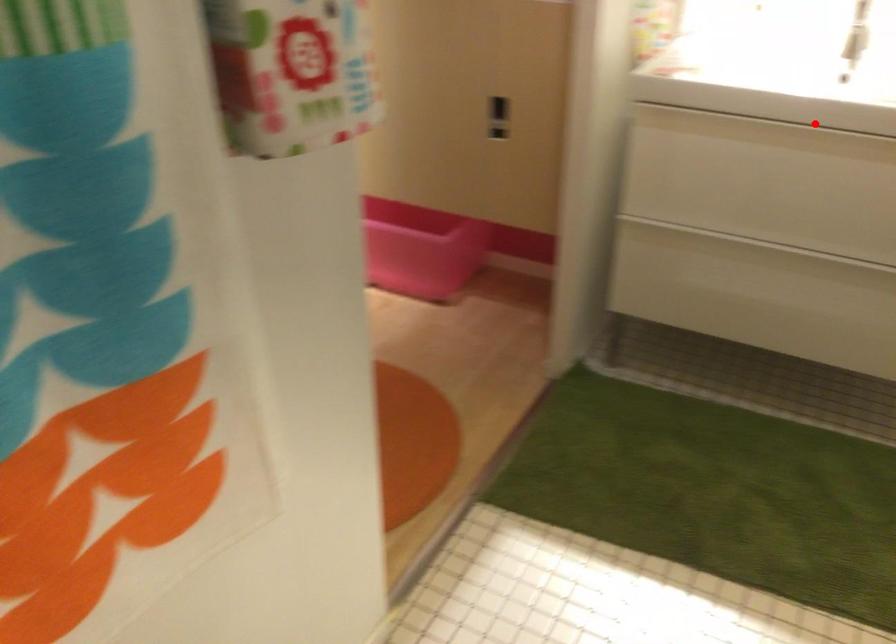
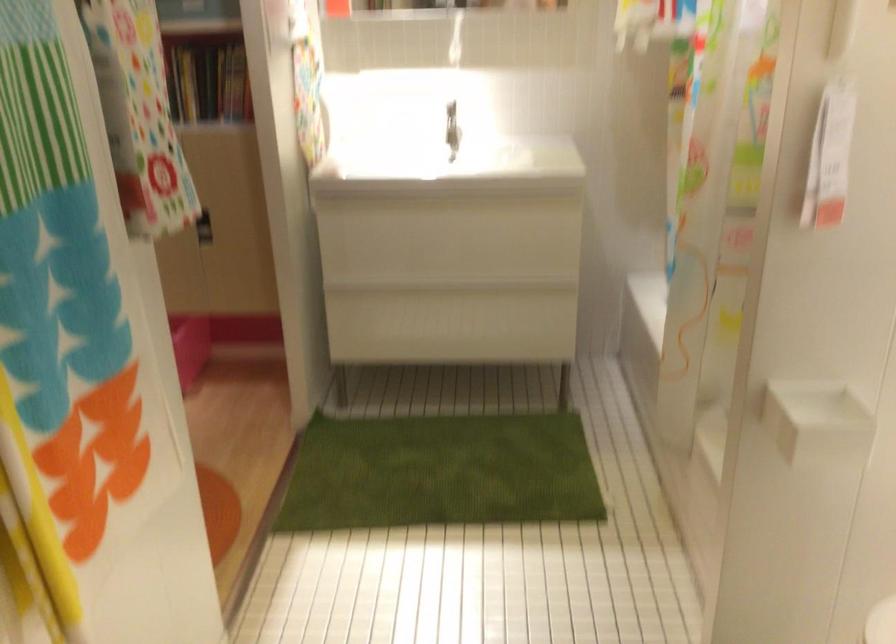
In the second image, find the point that corresponds to the highlighted location in the first image.

(440, 201)